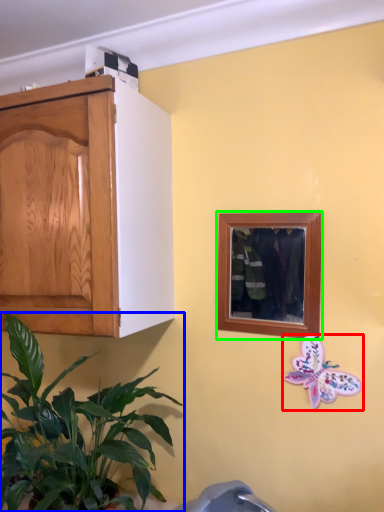
Question: Which object is positioned farthest from butterfly (highlighted by a red box)? Select from houseplant (highlighted by a blue box) and picture frame (highlighted by a green box).

Choices:
 (A) houseplant
 (B) picture frame

Answer: (A)